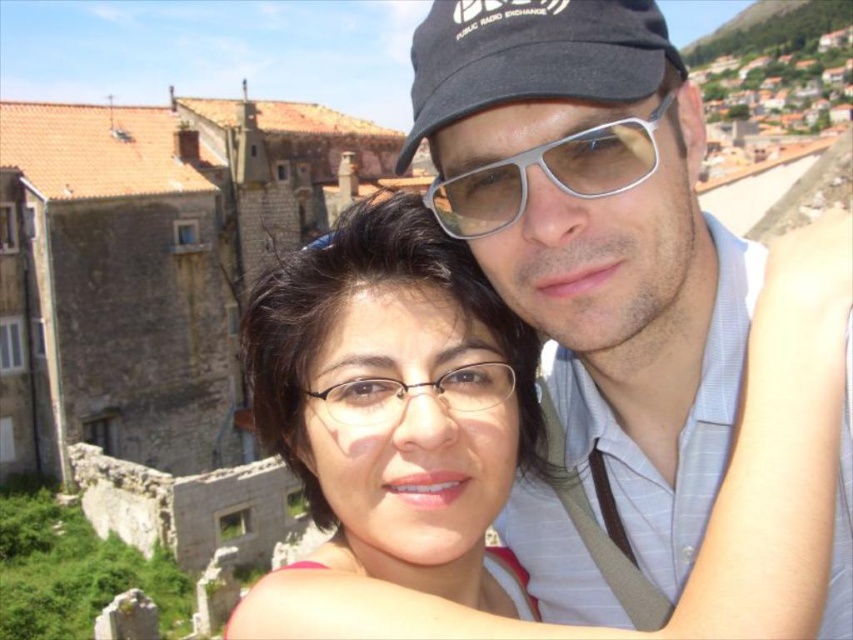
Is silver metallic goggles at center wider than clear plastic glasses at center?

Yes.

Does point (619, 161) come farther from viewer compared to point (512, 387)?

No, it is in front of (512, 387).

Describe the element at coordinates (549, 173) in the screenshot. I see `silver metallic goggles at center` at that location.

Identify the location of silver metallic goggles at center. (549, 173).

Looking at this image, is matte black cap at upper center bigger than silver metallic goggles at center?

Yes, matte black cap at upper center is bigger than silver metallic goggles at center.

Does point (842, 624) lie in front of point (554, 179)?

Yes.

At what (x,y) coordinates should I click in order to perform the action: click on matte black cap at upper center. Please return your answer as a coordinate pair (x, y). Looking at the image, I should click on [596, 240].

Which is more to the right, matte black cap at upper center or matte black hair at center?

From the viewer's perspective, matte black cap at upper center appears more on the right side.

The image size is (853, 640). Find the location of `matte black cap at upper center`. matte black cap at upper center is located at coordinates (596, 240).